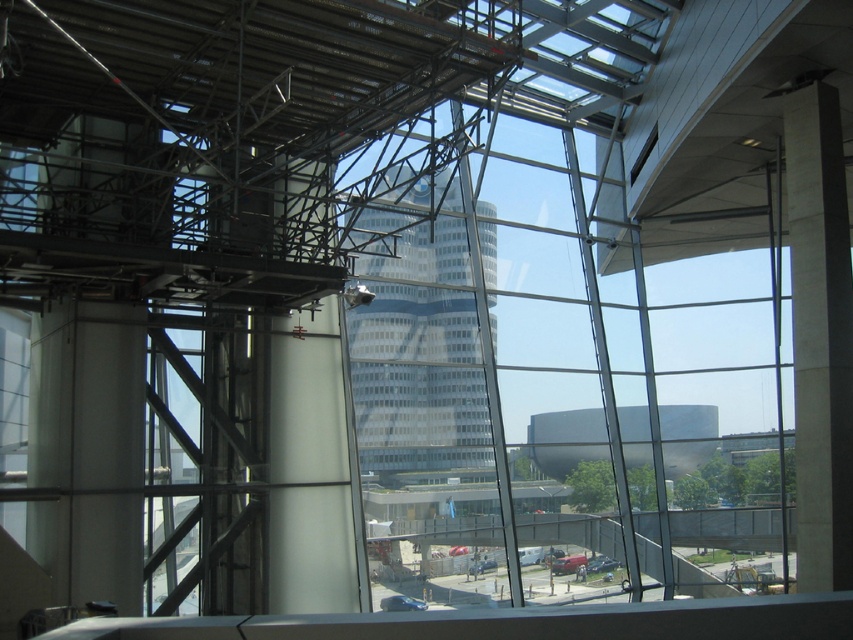
Question: Which point appears farthest from the camera in this image?

Choices:
 (A) (477, 372)
 (B) (796, 499)

Answer: (A)

Question: Is white glass tower at center smaller than white glossy pillar at center-left?

Choices:
 (A) yes
 (B) no

Answer: (B)

Question: Which point is farther from the camera taking this photo?

Choices:
 (A) (419, 474)
 (B) (801, 134)
 (C) (289, 353)

Answer: (A)

Question: Can you confirm if smooth concrete pillar at right is thinner than white glossy pillar at center-left?

Choices:
 (A) no
 (B) yes

Answer: (B)

Question: Which of the following is the closest to the observer?

Choices:
 (A) (846, 461)
 (B) (422, 420)

Answer: (A)

Question: Is the position of white glass tower at center less distant than that of white glossy pillar at center-left?

Choices:
 (A) no
 (B) yes

Answer: (B)